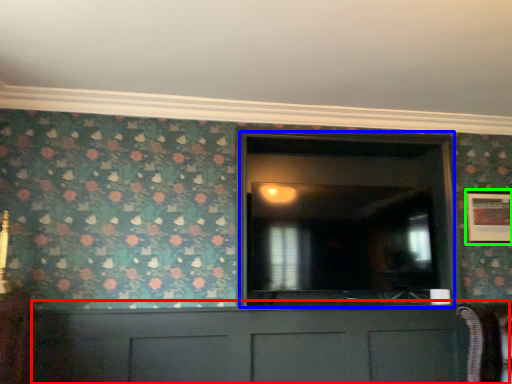
Question: Based on their relative distances, which object is farther from cabinetry (highlighted by a red box)? Choose from glass door (highlighted by a blue box) and picture frame (highlighted by a green box).

Choices:
 (A) glass door
 (B) picture frame

Answer: (B)